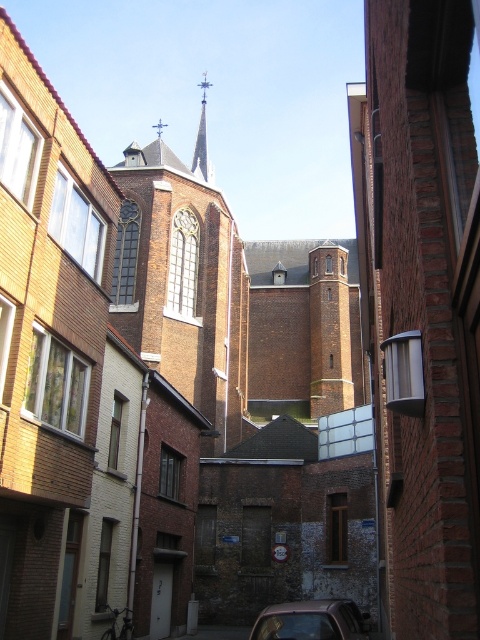
Question: Does metallic silver car at center appear over smooth gray spire at center?

Choices:
 (A) yes
 (B) no

Answer: (B)

Question: Does metallic silver car at center have a lesser width compared to smooth gray spire at center?

Choices:
 (A) no
 (B) yes

Answer: (B)

Question: Which of the following is the closest to the observer?

Choices:
 (A) (301, 612)
 (B) (205, 140)

Answer: (A)

Question: Can you confirm if metallic silver car at center is positioned to the left of smooth gray spire at center?

Choices:
 (A) yes
 (B) no

Answer: (B)

Question: Among these objects, which one is farthest from the camera?

Choices:
 (A) metallic silver car at center
 (B) smooth gray spire at center

Answer: (B)